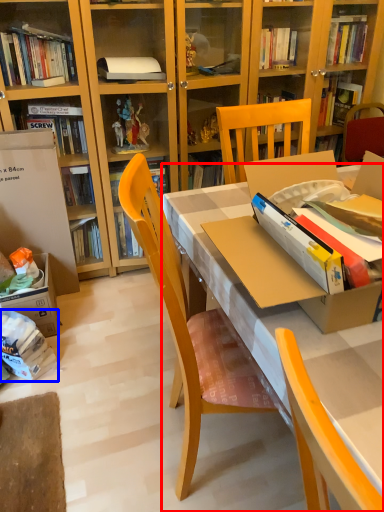
Question: Which point is closer to the camera, desk (highlighted by a red box) or book (highlighted by a blue box)?

Choices:
 (A) desk
 (B) book

Answer: (A)